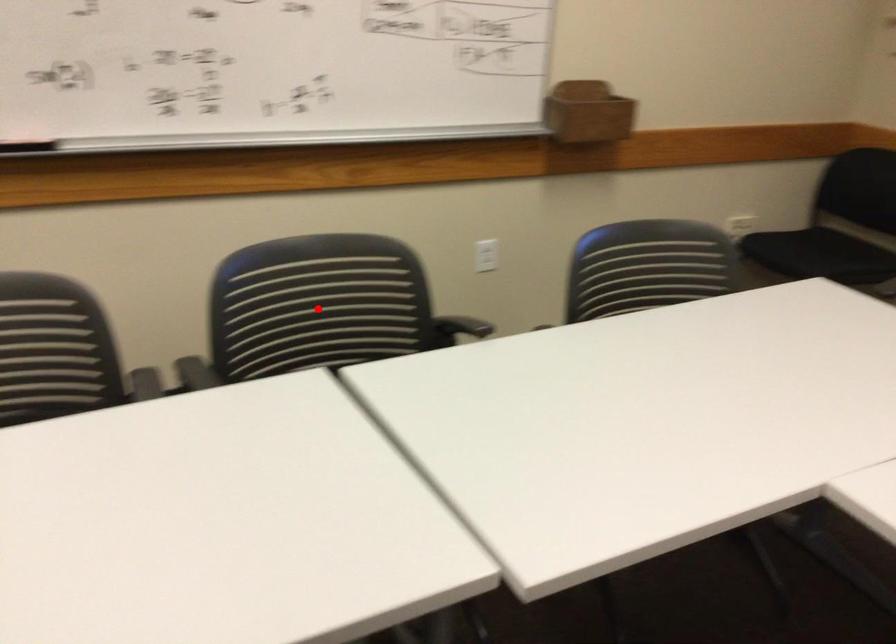
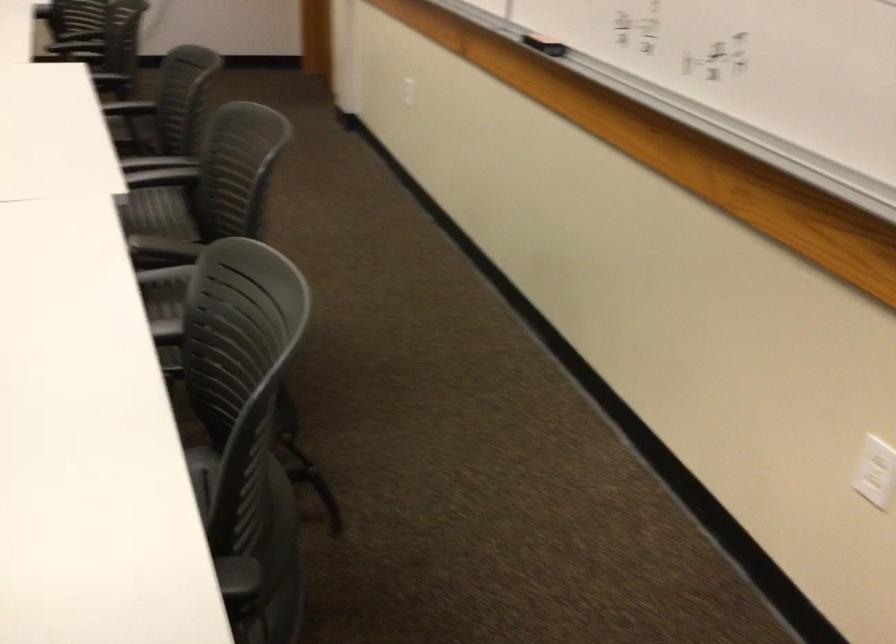
Question: I am providing you with two images of the same scene from different viewpoints. A red point is marked on the first image. Is the red point's position out of view in image 2?

Choices:
 (A) Yes
 (B) No

Answer: (A)